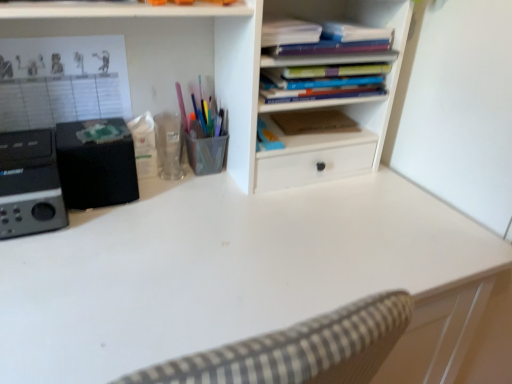
Question: Is point (138, 362) closer or farther from the camera than point (322, 74)?

Choices:
 (A) closer
 (B) farther

Answer: (A)

Question: In the image, is white matte desk at center positioned in front of or behind hardcover books at upper center, which is the second book from top to bottom?

Choices:
 (A) behind
 (B) front

Answer: (B)

Question: Which is farther from the brown matte paper at center?

Choices:
 (A) hardcover books at upper center, which is the second book from top to bottom
 (B) black matte speaker at left
 (C) white matte desk at center
 (D) matte blue notebook at upper center, which ranks as the first book in top-to-bottom order
 (E) black plastic speaker at left

Answer: (E)

Question: Estimate the real-world distances between objects in this image. Which object is closer to the translucent plastic pen holder at center?

Choices:
 (A) black matte speaker at left
 (B) matte blue notebook at upper center, which ranks as the first book in top-to-bottom order
 (C) white matte desk at center
 (D) black plastic speaker at left
 (E) hardcover books at upper center, which is the second book from top to bottom

Answer: (A)